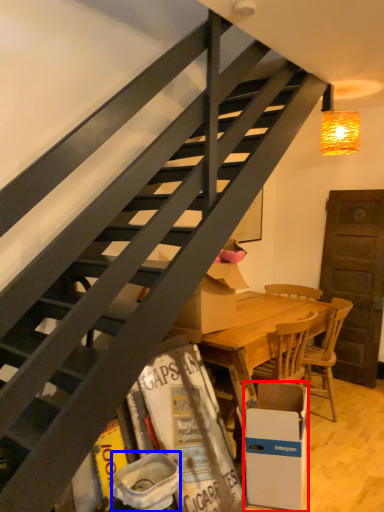
Question: Which object is closer to the camera taking this photo, box (highlighted by a red box) or trash bin/can (highlighted by a blue box)?

Choices:
 (A) box
 (B) trash bin/can

Answer: (B)